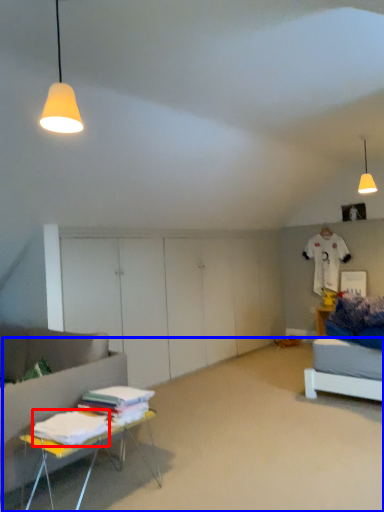
Question: Which point is further to the camera, sheet (highlighted by a red box) or plain (highlighted by a blue box)?

Choices:
 (A) sheet
 (B) plain

Answer: (A)